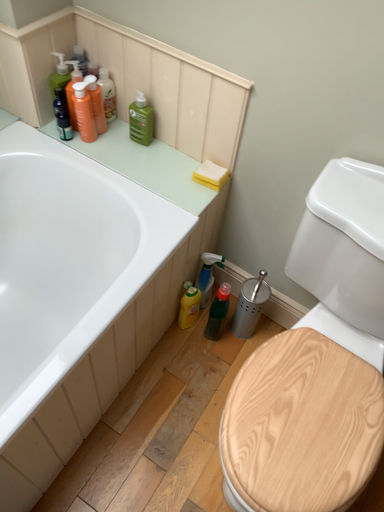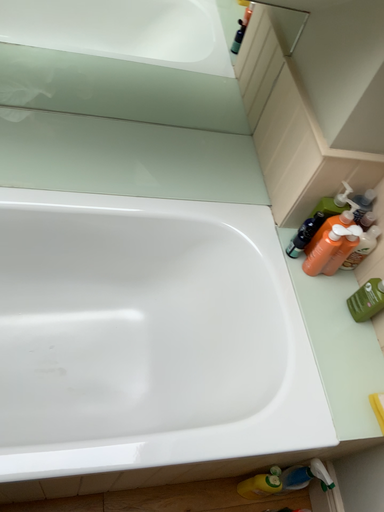
Question: How did the camera likely rotate when shooting the video?

Choices:
 (A) rotated left
 (B) rotated right

Answer: (A)